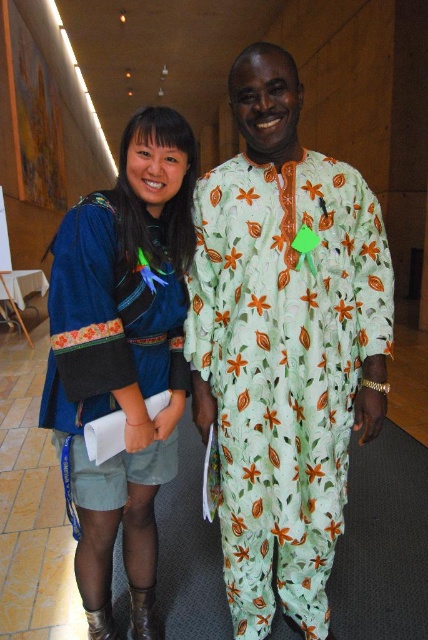
You are organizing a photo shoot and need to place two props between the green floral fabric at center and the velvet blue dress at center. Given their sizes, which prop should you place closer to the camera to ensure both are visible in the frame?

The green floral fabric at center is larger than the velvet blue dress at center, so placing the larger prop closer to the camera will ensure both are visible in the frame.

You are planning to take a photo of the two people in the image. The photographer wants to ensure that both the green floral fabric at center and the velvet blue dress at center are fully visible in the frame. Based on their heights, which one might require adjusting the camera angle to avoid being cut off?

The green floral fabric at center is shorter than the velvet blue dress at center, so the velvet blue dress at center might require adjusting the camera angle to avoid being cut off since it is taller.

You are at a formal event and need to locate two specific points in the image. The first point is at coordinates point (256, 349) and the second is at point (70, 291). Which of these points is positioned further back in the scene?

Point (256, 349) is behind point (70, 291), so it is positioned further back in the scene.